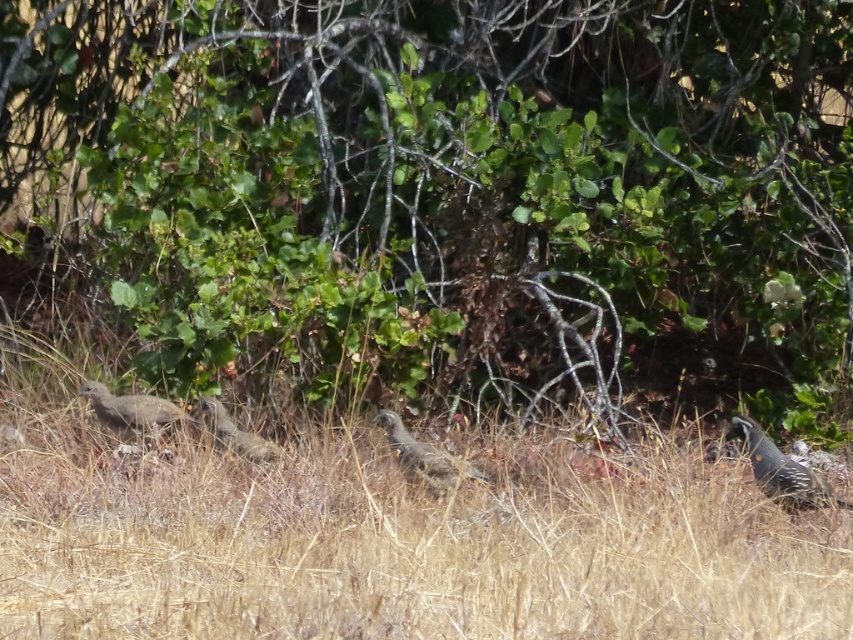
Is point (418, 499) in front of point (144, 429)?

Yes, it is.

The height and width of the screenshot is (640, 853). I want to click on dry grass at center, so click(x=399, y=541).

Describe the element at coordinates (451, 189) in the screenshot. The height and width of the screenshot is (640, 853). I see `green leafy tree at center` at that location.

Looking at this image, is green leafy tree at center positioned before gray speckled bird at center?

No, green leafy tree at center is behind gray speckled bird at center.

Does point (809, 161) come farther from viewer compared to point (436, 486)?

That is True.

Where is `green leafy tree at center`? The width and height of the screenshot is (853, 640). green leafy tree at center is located at coordinates (451, 189).

Which is below, speckled feathered quail at right or speckled brown bird at left?

speckled feathered quail at right is below.

Is point (788, 484) closer to viewer compared to point (134, 428)?

Yes.

Image resolution: width=853 pixels, height=640 pixels. In order to click on speckled feathered quail at right in this screenshot , I will do `click(782, 472)`.